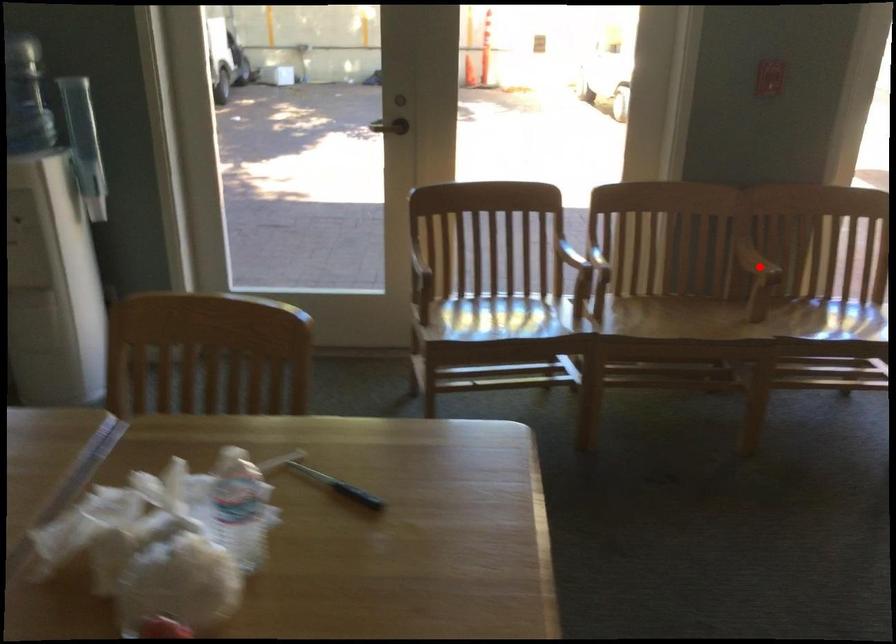
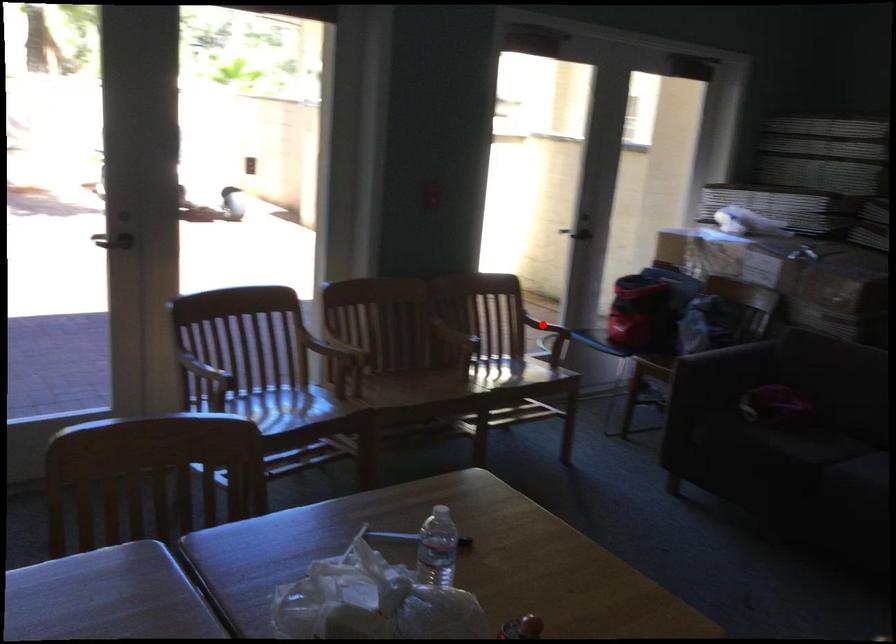
I am providing you with two images of the same scene from different viewpoints. A red point is marked on the first image and another point is marked on the second image. Does the point marked in image1 correspond to the same location as the one in image2?

No